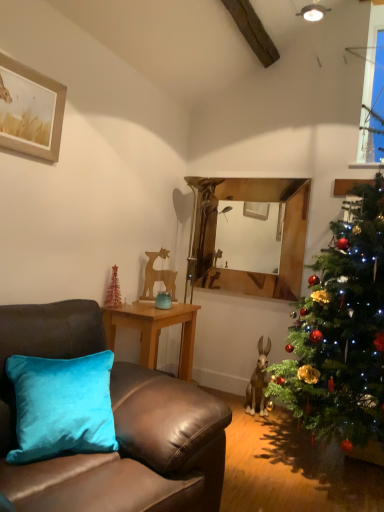
Identify the location of free space to the left of teal velvet vase at center. (139, 308).